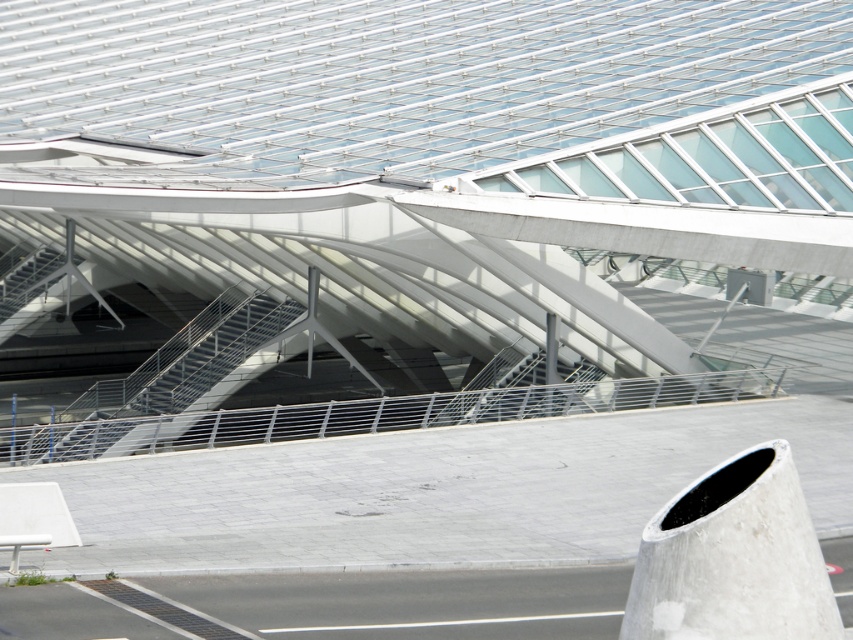
The image size is (853, 640). What do you see at coordinates (166, 376) in the screenshot?
I see `metallic gray stairs at center` at bounding box center [166, 376].

Does metallic gray stairs at center lie behind metallic gray stair at center?

That is False.

Who is more forward, (10,433) or (519,384)?

Point (10,433)

At what (x,y) coordinates should I click in order to perform the action: click on metallic gray stairs at center. Please return your answer as a coordinate pair (x, y). Image resolution: width=853 pixels, height=640 pixels. Looking at the image, I should click on (166, 376).

Can you confirm if metallic gray stairs at center is positioned to the left of metallic gray stairs at upper left?

No, metallic gray stairs at center is not to the left of metallic gray stairs at upper left.

Who is more forward, (260, 316) or (32, 269)?

Point (260, 316) is more forward.

Does point (242, 355) come behind point (38, 285)?

No, (242, 355) is in front of (38, 285).

You are a GUI agent. You are given a task and a screenshot of the screen. Output one action in this format:
    pyautogui.click(x=<x>, y=<y>)
    Task: Click on the metallic gray stairs at center
    This screenshot has height=640, width=853.
    Given the screenshot: What is the action you would take?
    pyautogui.click(x=166, y=376)

Is point (521, 413) behind point (47, 256)?

No.

Between point (428, 424) and point (16, 285), which one is positioned in front?

Point (428, 424)

Where is `metallic gray stair at center`? The width and height of the screenshot is (853, 640). metallic gray stair at center is located at coordinates pyautogui.click(x=511, y=390).